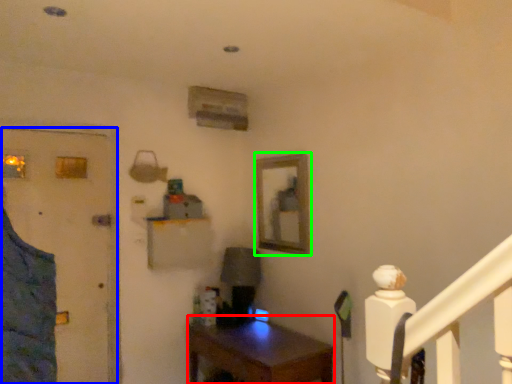
Question: Considering the real-world distances, which object is closest to desk (highlighted by a red box)? door (highlighted by a blue box) or picture frame (highlighted by a green box).

Choices:
 (A) door
 (B) picture frame

Answer: (B)